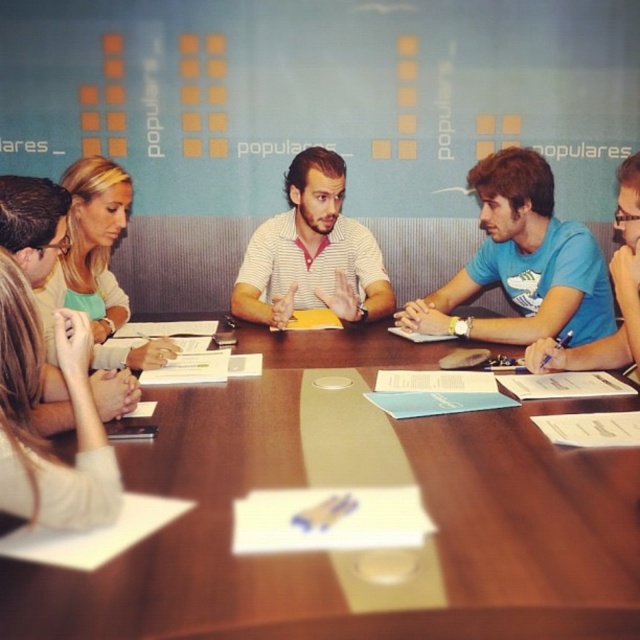
Question: Which object appears farthest from the camera in this image?

Choices:
 (A) wooden table at center
 (B) blue matte shirt at center
 (C) striped shirt at center
 (D) blue t-shirt at center

Answer: (C)

Question: In this image, where is blue matte shirt at center located relative to blonde hair at upper left?

Choices:
 (A) above
 (B) below

Answer: (A)

Question: Which is nearer to the wooden table at center?

Choices:
 (A) blue t-shirt at center
 (B) blonde hair at upper left
 (C) striped shirt at center

Answer: (A)

Question: Does wooden table at center have a greater width compared to blue matte shirt at center?

Choices:
 (A) no
 (B) yes

Answer: (B)

Question: Where is blonde hair at upper left located in relation to blue t-shirt at center in the image?

Choices:
 (A) below
 (B) above

Answer: (A)

Question: Which point is farther to the camera?

Choices:
 (A) blonde hair at upper left
 (B) wooden table at center

Answer: (A)